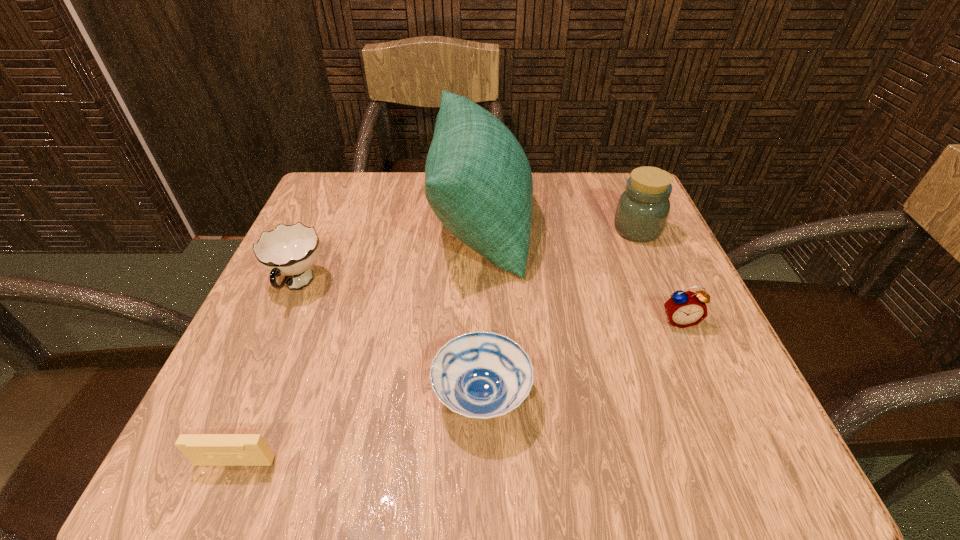
Locate an element on the screen. vacant area located 0.180m on the left of the fifth farthest object is located at coordinates (306, 397).

Image resolution: width=960 pixels, height=540 pixels. Identify the location of cushion that is at the far edge. (478, 181).

Identify the location of jar situated at the far edge. (642, 211).

Identify the location of soup bowl present at the near edge. The height and width of the screenshot is (540, 960). (482, 375).

Identify the location of videotape that is at the near edge. (201, 449).

The height and width of the screenshot is (540, 960). I want to click on cup present at the left edge, so click(x=288, y=250).

The height and width of the screenshot is (540, 960). I want to click on videotape at the left edge, so click(x=201, y=449).

At what (x,y) coordinates should I click in order to perform the action: click on jar at the right edge. Please return your answer as a coordinate pair (x, y). This screenshot has width=960, height=540. Looking at the image, I should click on (642, 211).

Identify the location of alarm clock present at the right edge. Image resolution: width=960 pixels, height=540 pixels. (684, 309).

The image size is (960, 540). I want to click on object situated at the near left corner, so click(x=201, y=449).